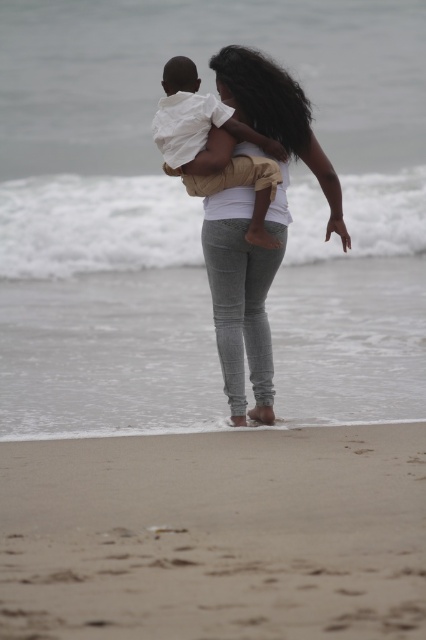
Question: Considering the relative positions of gray textured pants at center and white cotton shirt at center in the image provided, where is gray textured pants at center located with respect to white cotton shirt at center?

Choices:
 (A) above
 (B) below

Answer: (B)

Question: Which point is farther to the camera?

Choices:
 (A) (265, 397)
 (B) (253, 609)
 (C) (250, 220)

Answer: (A)

Question: Which object is the closest to the gray textured pants at center?

Choices:
 (A) white cotton shirt at center
 (B) sandy beach at lower center

Answer: (A)

Question: Which of the following is the closest to the observer?

Choices:
 (A) (209, 168)
 (B) (290, 589)

Answer: (B)

Question: Is sandy beach at lower center thinner than white cotton shirt at center?

Choices:
 (A) yes
 (B) no

Answer: (B)

Question: Can you confirm if sandy beach at lower center is thinner than gray textured pants at center?

Choices:
 (A) yes
 (B) no

Answer: (B)